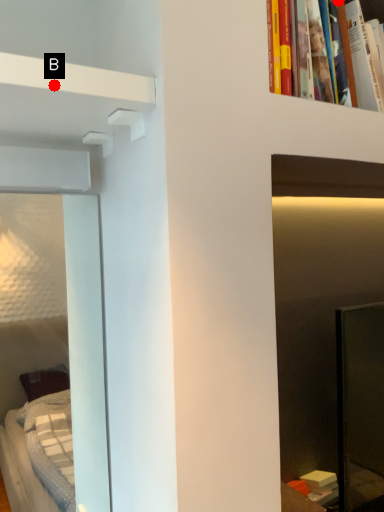
Question: Two points are circled on the image, labeled by A and B beside each circle. Which point is further to the camera?

Choices:
 (A) A is further
 (B) B is further

Answer: (A)